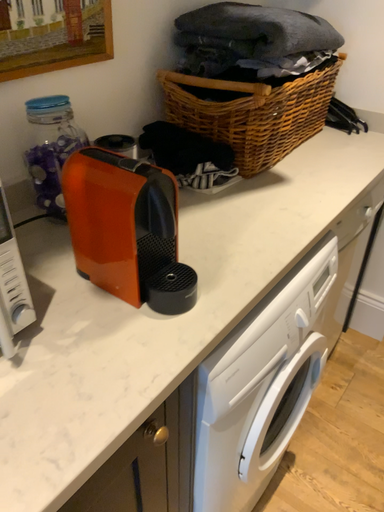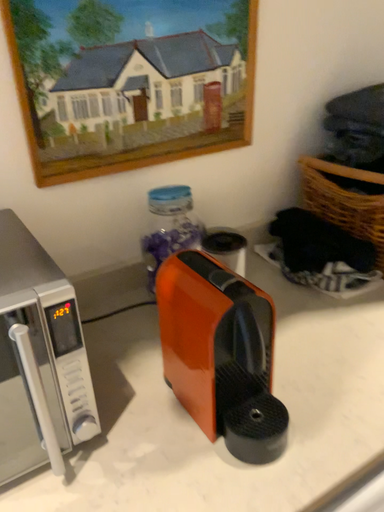
Question: How did the camera likely rotate when shooting the video?

Choices:
 (A) rotated right
 (B) rotated left

Answer: (B)